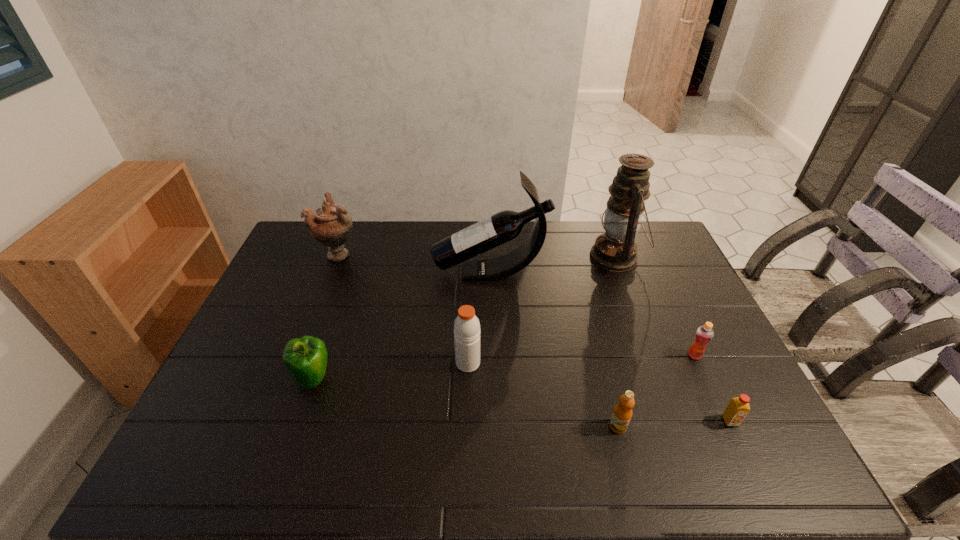
You are a GUI agent. You are given a task and a screenshot of the screen. Output one action in this format:
    pyautogui.click(x=<x>, y=<y>)
    Task: Click on the object present at the left edge
    The image size is (960, 540).
    Given the screenshot: What is the action you would take?
    pyautogui.click(x=330, y=225)

What are the coordinates of `lantern that is at the right edge` in the screenshot? It's located at (615, 250).

You are a GUI agent. You are given a task and a screenshot of the screen. Output one action in this format:
    pyautogui.click(x=<x>, y=<y>)
    Task: Click on the object that is at the far left corner
    The image size is (960, 540).
    Given the screenshot: What is the action you would take?
    pyautogui.click(x=330, y=225)

You are a GUI agent. You are given a task and a screenshot of the screen. Output one action in this format:
    pyautogui.click(x=<x>, y=<y>)
    Task: Click on the object that is at the far right corner
    Image resolution: width=960 pixels, height=540 pixels.
    Given the screenshot: What is the action you would take?
    pyautogui.click(x=615, y=250)

This screenshot has height=540, width=960. In the image, there is a desktop. Find the location of `vacant region at the far edge`. vacant region at the far edge is located at coordinates (361, 223).

Locate an element on the screen. This screenshot has height=540, width=960. vacant space at the near edge of the desktop is located at coordinates (683, 478).

Where is `free space at the left edge of the desktop`? This screenshot has height=540, width=960. free space at the left edge of the desktop is located at coordinates (311, 263).

At what (x,y) coordinates should I click in order to perform the action: click on free space at the right edge. Please return your answer as a coordinate pair (x, y). Image resolution: width=960 pixels, height=540 pixels. Looking at the image, I should click on (660, 305).

In the image, there is a desktop. Where is `vacant space at the far right corner`? Image resolution: width=960 pixels, height=540 pixels. vacant space at the far right corner is located at coordinates (660, 253).

Identify the location of vacant space at the near right corner of the desktop. Image resolution: width=960 pixels, height=540 pixels. [x=752, y=462].